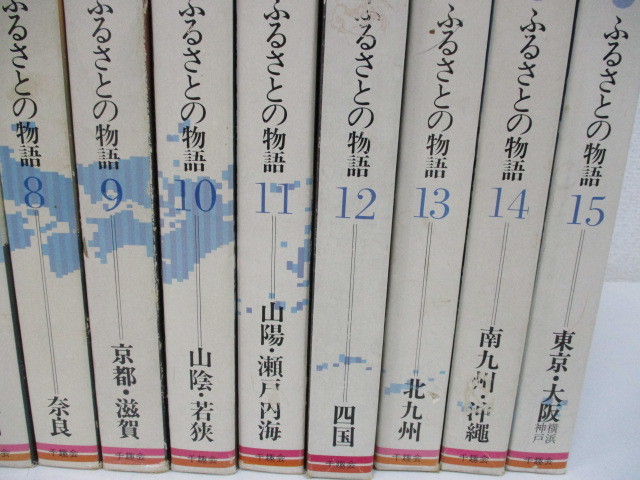
The width and height of the screenshot is (640, 480). I want to click on book 10, so click(x=198, y=201).